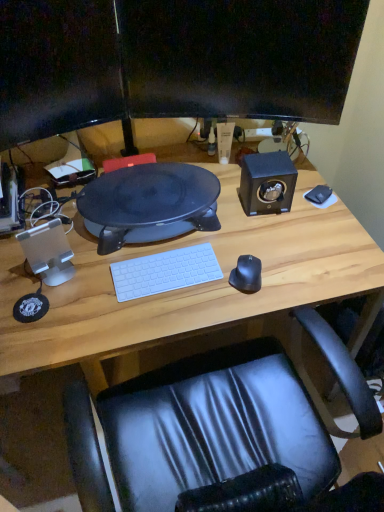
You are a GUI agent. You are given a task and a screenshot of the screen. Output one action in this format:
    pyautogui.click(x=<x>, y=<y>)
    Task: Click on the free space in front of white matte keyboard at center
    The height and width of the screenshot is (512, 384).
    Given the screenshot: What is the action you would take?
    pyautogui.click(x=155, y=316)